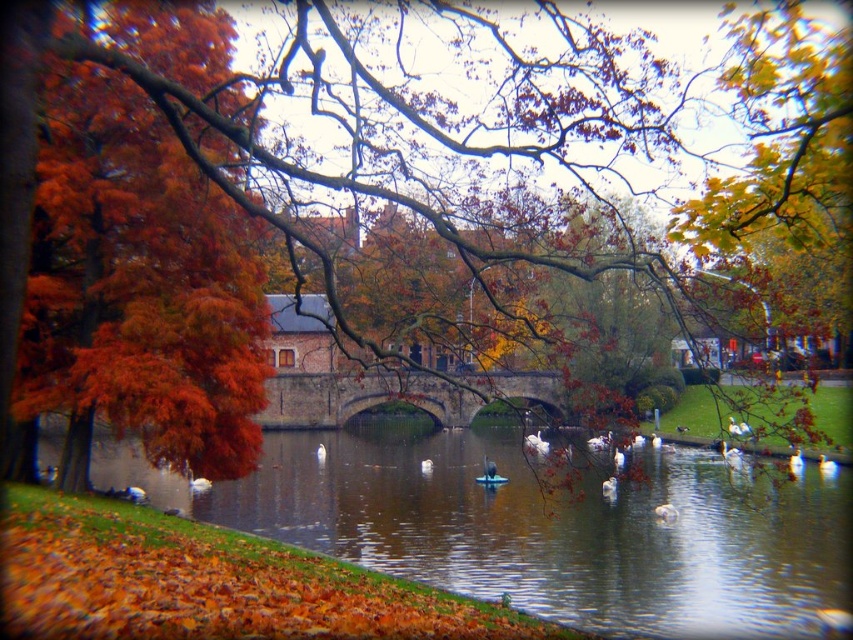
Question: Considering the real-world distances, which object is closest to the brown reflective water at center?

Choices:
 (A) vivid orange leaves at left
 (B) brown stone bridge at center

Answer: (A)

Question: Is vivid orange leaves at left smaller than brown stone bridge at center?

Choices:
 (A) no
 (B) yes

Answer: (B)

Question: Is brown reflective water at center further to camera compared to brown stone bridge at center?

Choices:
 (A) no
 (B) yes

Answer: (A)

Question: Which object is the farthest from the brown stone bridge at center?

Choices:
 (A) brown reflective water at center
 (B) vivid orange leaves at left

Answer: (A)

Question: Does vivid orange leaves at left have a smaller size compared to brown stone bridge at center?

Choices:
 (A) yes
 (B) no

Answer: (A)

Question: Based on their relative distances, which object is farther from the vivid orange leaves at left?

Choices:
 (A) brown stone bridge at center
 (B) brown reflective water at center

Answer: (B)